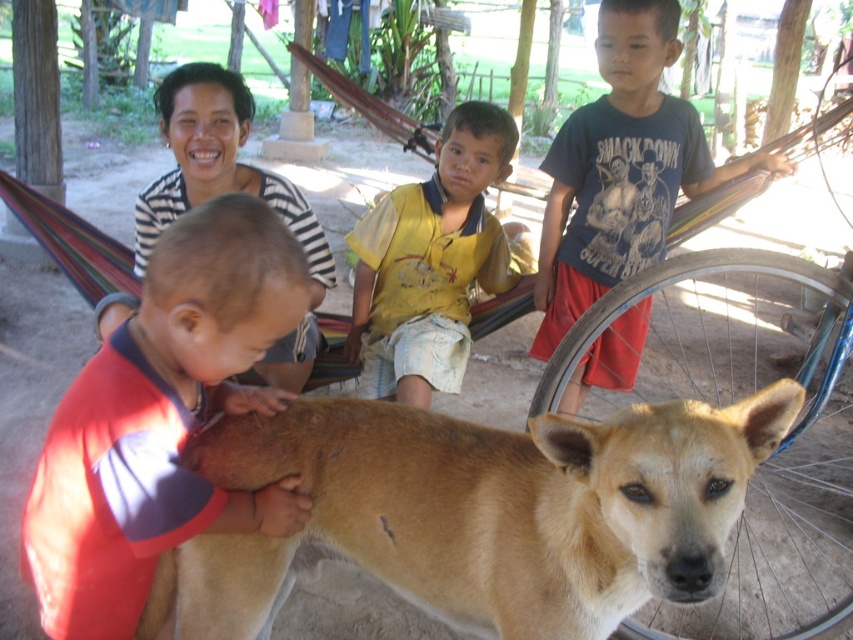
Can you confirm if dark blue t-shirt at upper right is positioned to the right of yellow cotton shirt at center?

Yes, dark blue t-shirt at upper right is to the right of yellow cotton shirt at center.

Is dark blue t-shirt at upper right taller than yellow cotton shirt at center?

Yes, dark blue t-shirt at upper right is taller than yellow cotton shirt at center.

This screenshot has height=640, width=853. Find the location of `dark blue t-shirt at upper right`. dark blue t-shirt at upper right is located at coordinates (622, 168).

Which is more to the right, dark blue t-shirt at upper right or matte brown dog at center?

From the viewer's perspective, dark blue t-shirt at upper right appears more on the right side.

Does dark blue t-shirt at upper right appear on the left side of matte brown dog at center?

No, dark blue t-shirt at upper right is not to the left of matte brown dog at center.

Which is in front, point (630, 84) or point (285, 348)?

Point (285, 348)

Find the location of a particular element. This screenshot has width=853, height=640. dark blue t-shirt at upper right is located at coordinates (622, 168).

Can you confirm if red cotton shirt at left is taller than matte brown dog at center?

In fact, red cotton shirt at left may be shorter than matte brown dog at center.

Can you confirm if red cotton shirt at left is positioned above matte brown dog at center?

Actually, red cotton shirt at left is below matte brown dog at center.

Measure the distance between point [254,241] and camera.

The distance of point [254,241] from camera is 1.16 meters.

Image resolution: width=853 pixels, height=640 pixels. Find the location of `red cotton shirt at left`. red cotton shirt at left is located at coordinates (161, 420).